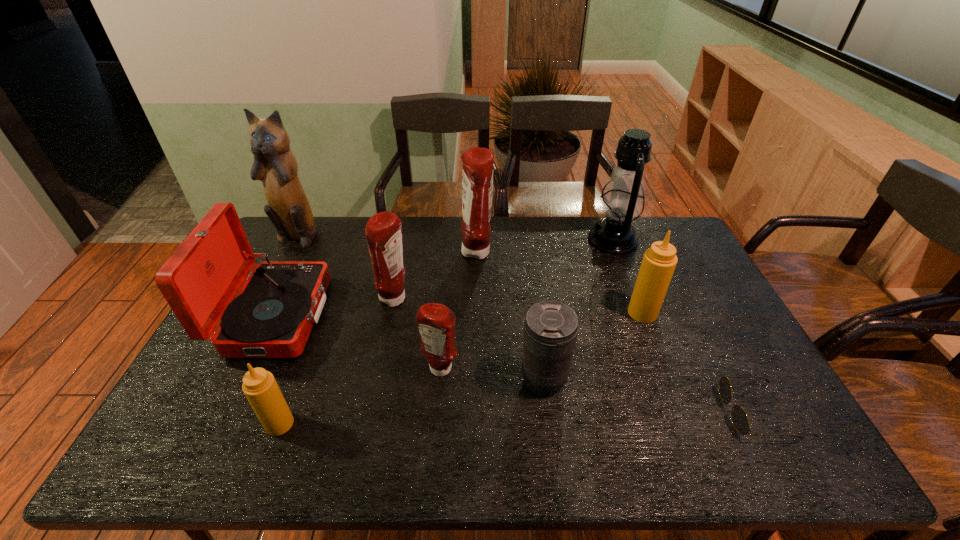
Where is `vacant space at the far edge`? vacant space at the far edge is located at coordinates (523, 248).

Identify the location of vacant space at the near edge of the desktop. The image size is (960, 540). (706, 448).

Where is `vacant space at the right edge of the desktop`? This screenshot has width=960, height=540. vacant space at the right edge of the desktop is located at coordinates (707, 382).

At what (x,y) coordinates should I click in order to perform the action: click on free space at the far left corner of the desktop. Please return your answer as a coordinate pair (x, y). This screenshot has height=540, width=960. Looking at the image, I should click on (287, 255).

The image size is (960, 540). In order to click on free space at the near left corner of the desktop in this screenshot , I will do `click(180, 439)`.

The height and width of the screenshot is (540, 960). I want to click on free space at the near right corner of the desktop, so click(742, 449).

Locate an element on the screen. The width and height of the screenshot is (960, 540). free space between the nearest red condiment and the tallest condiment is located at coordinates (459, 311).

Locate an element on the screen. Image resolution: width=960 pixels, height=540 pixels. unoccupied position between the oil lamp and the cat is located at coordinates (455, 238).

Locate an element on the screen. This screenshot has height=540, width=960. free space that is in between the phonograph_record and the nearest condiment is located at coordinates (277, 370).

Find the location of a particular element. empty location between the phonograph_record and the oil lamp is located at coordinates (444, 278).